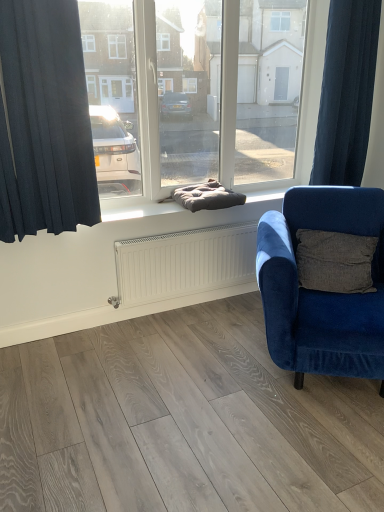
Where is `free location in front of velvet blue armchair at right`? This screenshot has width=384, height=512. free location in front of velvet blue armchair at right is located at coordinates (298, 448).